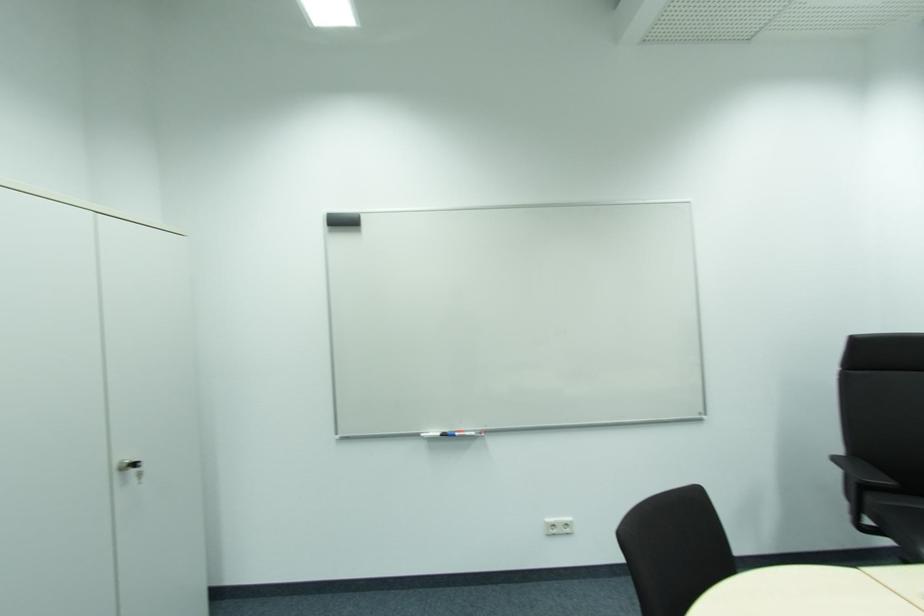
What do you see at coordinates (858, 471) in the screenshot?
I see `a black chair armrest` at bounding box center [858, 471].